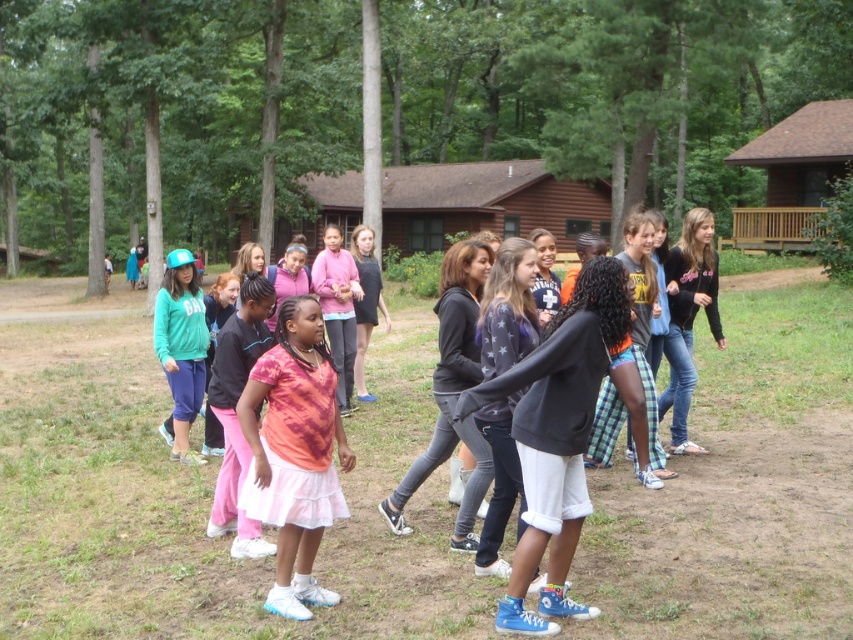
Question: Which point appears closest to the camera in this image?

Choices:
 (A) (395, 204)
 (B) (277, 417)
 (C) (572, 456)
 (D) (795, 122)

Answer: (C)

Question: Can you confirm if tie-dye fabric shirt at center is smaller than brown wooden cabin at center?

Choices:
 (A) no
 (B) yes

Answer: (B)

Question: Observing the image, what is the correct spatial positioning of black cotton sweatshirt at center in reference to brown wooden cabin at upper right?

Choices:
 (A) above
 (B) below

Answer: (B)

Question: Based on their relative distances, which object is nearer to the pink fabric skirt at center?

Choices:
 (A) black cotton sweatshirt at center
 (B) tie-dye fabric shirt at center

Answer: (B)

Question: Is tie-dye fabric shirt at center positioned in front of pink fabric skirt at center?

Choices:
 (A) yes
 (B) no

Answer: (A)

Question: Which of the following is the farthest from the observer?

Choices:
 (A) (566, 193)
 (B) (267, 332)
 (C) (469, 390)

Answer: (A)